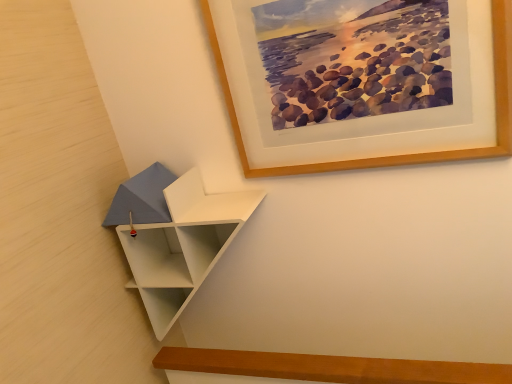
Question: Can wooden picture frame at upper center be found inside white matte/shelf at lower left?

Choices:
 (A) no
 (B) yes

Answer: (A)

Question: Is the depth of white matte/shelf at lower left less than that of wooden picture frame at upper center?

Choices:
 (A) yes
 (B) no

Answer: (B)

Question: Are white matte/shelf at lower left and wooden picture frame at upper center located far from each other?

Choices:
 (A) no
 (B) yes

Answer: (A)

Question: From the image's perspective, is white matte/shelf at lower left over wooden picture frame at upper center?

Choices:
 (A) no
 (B) yes

Answer: (A)

Question: Is the position of white matte/shelf at lower left more distant than that of wooden picture frame at upper center?

Choices:
 (A) yes
 (B) no

Answer: (A)

Question: Is white matte/shelf at lower left thinner than wooden picture frame at upper center?

Choices:
 (A) yes
 (B) no

Answer: (B)

Question: Is wooden picture frame at upper center oriented towards white matte/shelf at lower left?

Choices:
 (A) yes
 (B) no

Answer: (B)

Question: Is wooden picture frame at upper center further to camera compared to white matte/shelf at lower left?

Choices:
 (A) no
 (B) yes

Answer: (A)

Question: Can you confirm if wooden picture frame at upper center is taller than white matte/shelf at lower left?

Choices:
 (A) no
 (B) yes

Answer: (A)

Question: From the image's perspective, is wooden picture frame at upper center below white matte/shelf at lower left?

Choices:
 (A) no
 (B) yes

Answer: (A)

Question: Does wooden picture frame at upper center have a larger size compared to white matte/shelf at lower left?

Choices:
 (A) yes
 (B) no

Answer: (B)

Question: Is wooden picture frame at upper center to the right of white matte/shelf at lower left from the viewer's perspective?

Choices:
 (A) no
 (B) yes

Answer: (B)

Question: From a real-world perspective, relative to wooden picture frame at upper center, is white matte/shelf at lower left vertically above or below?

Choices:
 (A) below
 (B) above

Answer: (A)